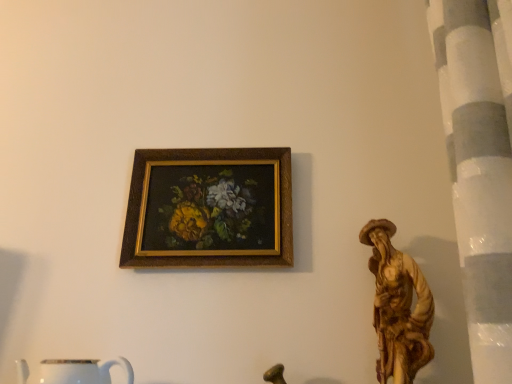
Question: From a real-world perspective, is white glossy mug at lower left above or below wooden frame at upper center?

Choices:
 (A) below
 (B) above

Answer: (A)

Question: From the image's perspective, is white glossy mug at lower left located above or below wooden frame at upper center?

Choices:
 (A) below
 (B) above

Answer: (A)

Question: In terms of size, does white glossy mug at lower left appear bigger or smaller than wooden frame at upper center?

Choices:
 (A) small
 (B) big

Answer: (B)

Question: From the image's perspective, is wooden frame at upper center above or below white glossy mug at lower left?

Choices:
 (A) above
 (B) below

Answer: (A)

Question: From a real-world perspective, is wooden frame at upper center physically located above or below white glossy mug at lower left?

Choices:
 (A) below
 (B) above

Answer: (B)

Question: In the image, is wooden frame at upper center positioned in front of or behind white glossy mug at lower left?

Choices:
 (A) front
 (B) behind

Answer: (B)

Question: Is wooden frame at upper center bigger or smaller than white glossy mug at lower left?

Choices:
 (A) small
 (B) big

Answer: (A)